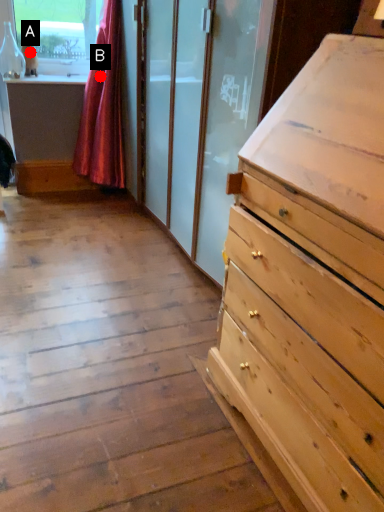
Question: Two points are circled on the image, labeled by A and B beside each circle. Which point appears farthest from the camera in this image?

Choices:
 (A) A is further
 (B) B is further

Answer: (A)